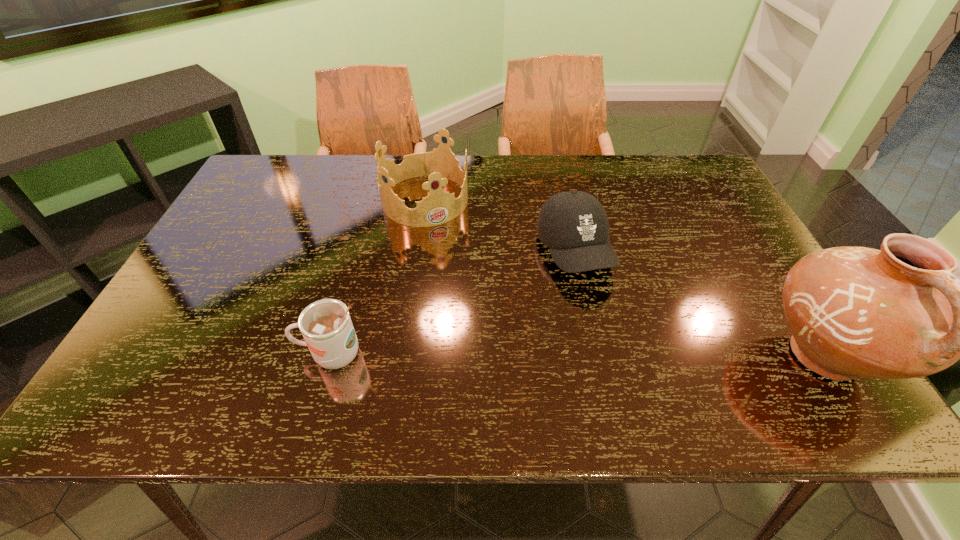
This screenshot has width=960, height=540. I want to click on free space at the near edge of the desktop, so click(x=377, y=368).

This screenshot has height=540, width=960. Find the location of `vacant region at the left edge of the desktop`. vacant region at the left edge of the desktop is located at coordinates (185, 285).

Locate an element on the screen. This screenshot has height=540, width=960. free spot at the right edge of the desktop is located at coordinates (749, 286).

In the image, there is a desktop. Identify the location of vacant space at the far left corner. (281, 157).

I want to click on blank space at the near left corner, so click(200, 353).

The width and height of the screenshot is (960, 540). What are the coordinates of `empty space that is in between the rightmost object and the tiara` in the screenshot? It's located at (625, 278).

At what (x,y) coordinates should I click in order to perform the action: click on vacant area that lies between the cup and the baseball cap. Please return your answer as a coordinate pair (x, y). Looking at the image, I should click on (452, 302).

Image resolution: width=960 pixels, height=540 pixels. Identify the location of blank region between the cup and the tallest object. (577, 355).

Where is `empty space that is in between the tallest object and the tiara`? empty space that is in between the tallest object and the tiara is located at coordinates (625, 278).

What are the coordinates of `free spot between the baseball cap and the pottery` in the screenshot? It's located at (699, 303).